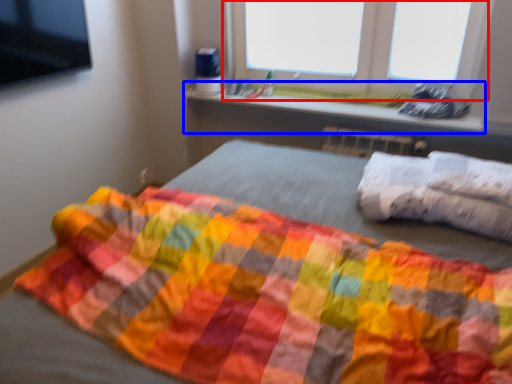
Question: Which point is closer to the camera, window (highlighted by a red box) or window sill (highlighted by a blue box)?

Choices:
 (A) window
 (B) window sill

Answer: (A)